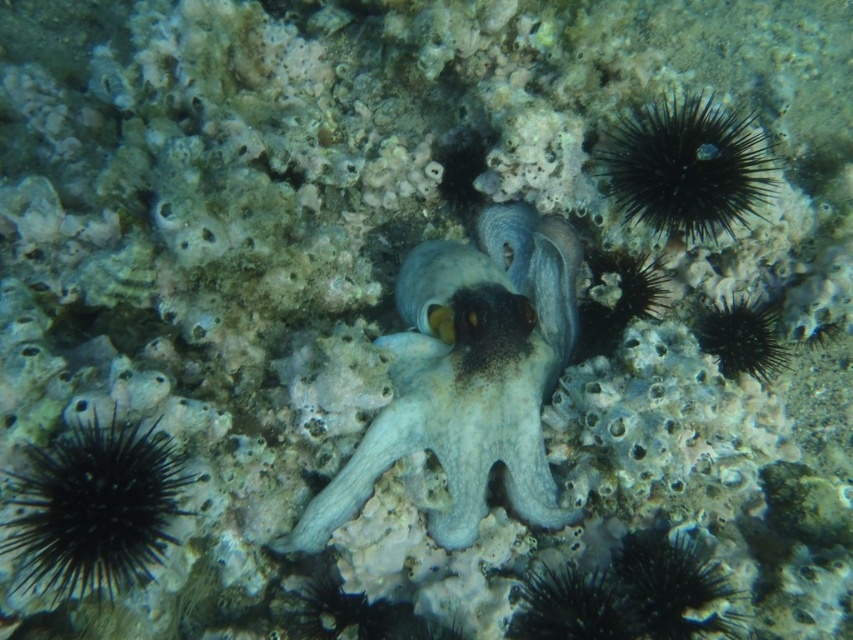
You are a marine biologist observing the underwater scene. You notice two black spiny sea urchins. Which one is closer to you, the black spiny sea urchin at lower left or the black spiny sea urchin at upper right?

The black spiny sea urchin at lower left is closer to you because it is positioned in front of the black spiny sea urchin at upper right.

From the picture: You are a marine biologist observing the underwater scene from a submarine. The gray matte octopus at center is part of your study. If your submarine is positioned 5 feet away from the octopus, can you safely approach it by moving forward 0.8 feet without getting too close?

The gray matte octopus at center is 4.13 feet away from the viewer. If the submarine is 5 feet away and moves forward 0.8 feet, the new distance would be 4.2 feet. Since 4.2 feet is still greater than the original 4.13 feet, the submarine would be slightly closer but not too close. However, since the required distance to maintain is not specified, the approach is possible but may be marginally closer than intended.